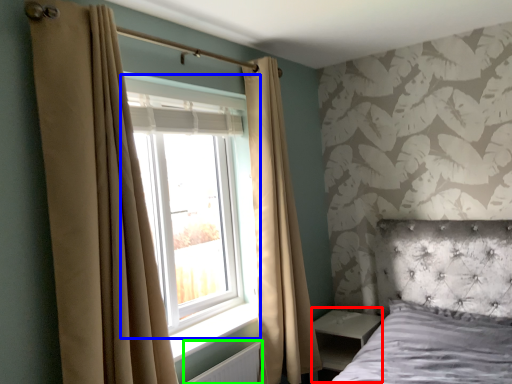
Question: Which object is positioned closest to side table (highlighted by a red box)? Select from window (highlighted by a blue box) and radiator (highlighted by a green box).

Choices:
 (A) window
 (B) radiator

Answer: (B)